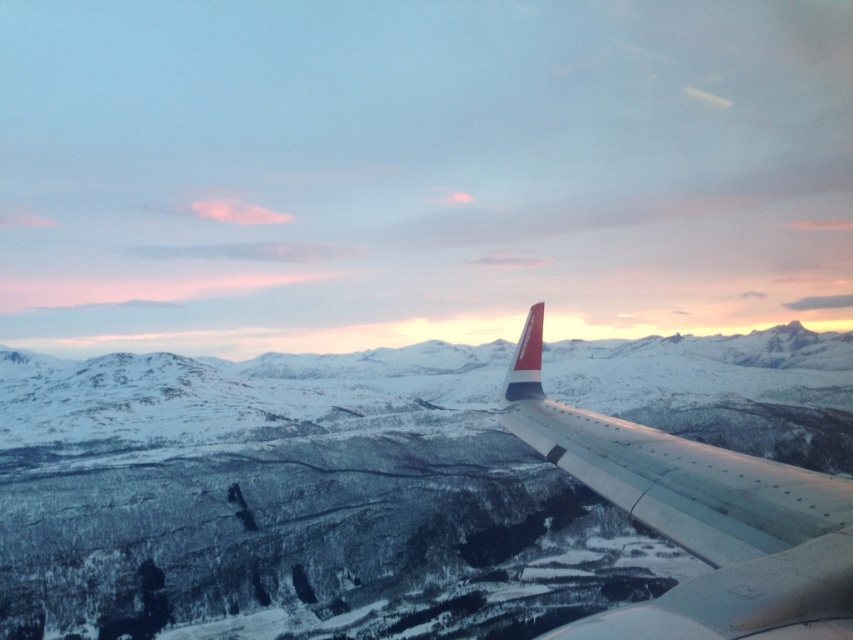
Question: Which point is farther from the camera taking this photo?

Choices:
 (A) (195, 612)
 (B) (828, 563)

Answer: (A)

Question: Among these points, which one is farthest from the camera?

Choices:
 (A) (204, 611)
 (B) (654, 636)

Answer: (A)

Question: Can you confirm if snowy mountain at center is wider than white metallic wing at right?

Choices:
 (A) yes
 (B) no

Answer: (A)

Question: Which object is closer to the camera taking this photo?

Choices:
 (A) snowy mountain at center
 (B) white metallic wing at right

Answer: (B)

Question: Does snowy mountain at center have a larger size compared to white metallic wing at right?

Choices:
 (A) yes
 (B) no

Answer: (A)

Question: Is snowy mountain at center to the left of white metallic wing at right from the viewer's perspective?

Choices:
 (A) yes
 (B) no

Answer: (A)